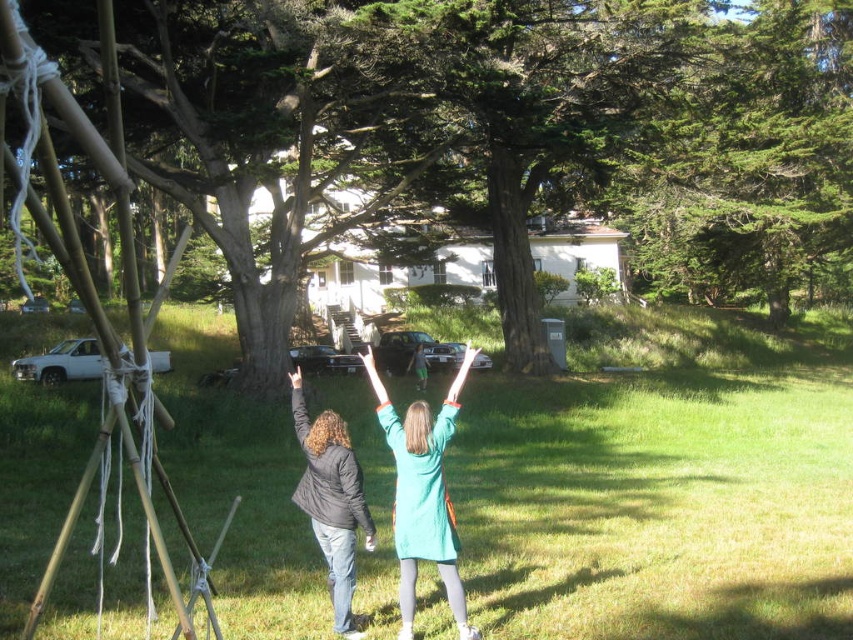
Question: Estimate the real-world distances between objects in this image. Which object is closer to the green matte dress at center?

Choices:
 (A) matte black jacket at center
 (B) green grass at center
 (C) green leafy tree at center

Answer: (A)

Question: Is green grass at center behind green leafy tree at center?

Choices:
 (A) yes
 (B) no

Answer: (B)

Question: Is green grass at center below green leafy tree at center?

Choices:
 (A) no
 (B) yes

Answer: (B)

Question: Which of the following is the closest to the observer?

Choices:
 (A) (460, 616)
 (B) (431, 132)

Answer: (A)

Question: Which point is closer to the camera?

Choices:
 (A) matte black jacket at center
 (B) green matte dress at center

Answer: (B)

Question: Is green matte dress at center closer to the viewer compared to matte black jacket at center?

Choices:
 (A) yes
 (B) no

Answer: (A)